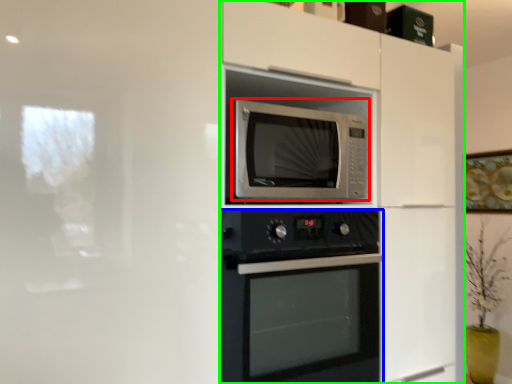
Question: Which object is the farthest from microwave oven (highlighted by a red box)? Choose among these: oven (highlighted by a blue box) or dresser (highlighted by a green box).

Choices:
 (A) oven
 (B) dresser

Answer: (A)